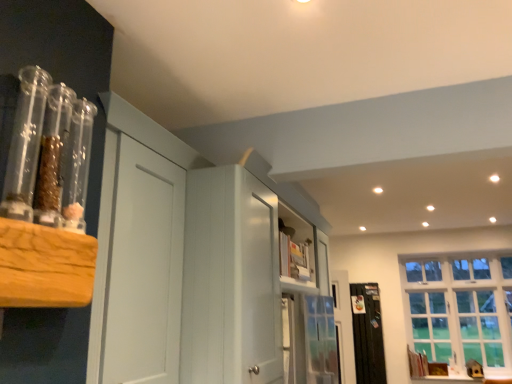
Question: Would you say black matte radiator at right is inside or outside white painted wood cabinet at center?

Choices:
 (A) inside
 (B) outside

Answer: (B)

Question: In terms of width, does black matte radiator at right look wider or thinner when compared to white painted wood cabinet at center?

Choices:
 (A) wide
 (B) thin

Answer: (B)

Question: Estimate the real-world distances between objects in this image. Which object is closer to the black matte radiator at right?

Choices:
 (A) white glass window at right
 (B) white painted wood cabinet at center

Answer: (A)

Question: Which object is positioned closest to the black matte radiator at right?

Choices:
 (A) white glass window at right
 (B) white painted wood cabinet at center

Answer: (A)